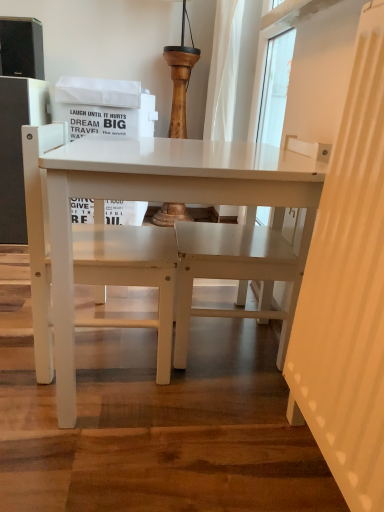
Question: Should I look upward or downward to see white matte table at center?

Choices:
 (A) down
 (B) up

Answer: (A)

Question: Is white matte table at center outside white matte chair at center?

Choices:
 (A) yes
 (B) no

Answer: (A)

Question: Is white matte table at center oriented away from white matte chair at center?

Choices:
 (A) no
 (B) yes

Answer: (B)

Question: Is white matte table at center smaller than white matte chair at center?

Choices:
 (A) yes
 (B) no

Answer: (B)

Question: Can you see white matte table at center touching white matte chair at center?

Choices:
 (A) no
 (B) yes

Answer: (B)

Question: Can you confirm if white matte table at center is positioned to the right of white matte chair at center?

Choices:
 (A) no
 (B) yes

Answer: (B)

Question: Is white matte table at center surrounding white matte chair at center?

Choices:
 (A) no
 (B) yes

Answer: (B)

Question: Does white matte chair at center have a lesser width compared to white matte table at center?

Choices:
 (A) no
 (B) yes

Answer: (B)

Question: From the image's perspective, would you say white matte chair at center is shown under white matte table at center?

Choices:
 (A) no
 (B) yes

Answer: (A)

Question: Is the depth of white matte chair at center less than that of white matte table at center?

Choices:
 (A) yes
 (B) no

Answer: (B)

Question: Is white matte chair at center located outside white matte table at center?

Choices:
 (A) yes
 (B) no

Answer: (B)

Question: Is white matte chair at center bigger than white matte table at center?

Choices:
 (A) yes
 (B) no

Answer: (B)

Question: Does white matte chair at center come behind white matte table at center?

Choices:
 (A) no
 (B) yes

Answer: (B)

Question: Considering the positions of white matte table at center and white matte chair at center in the image, is white matte table at center taller or shorter than white matte chair at center?

Choices:
 (A) short
 (B) tall

Answer: (B)